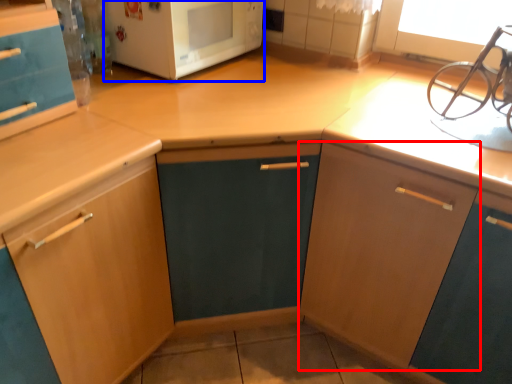
Question: Which point is closer to the camera, cabinetry (highlighted by a red box) or microwave oven (highlighted by a blue box)?

Choices:
 (A) cabinetry
 (B) microwave oven

Answer: (A)